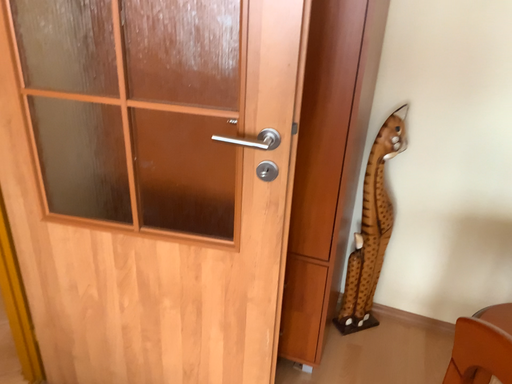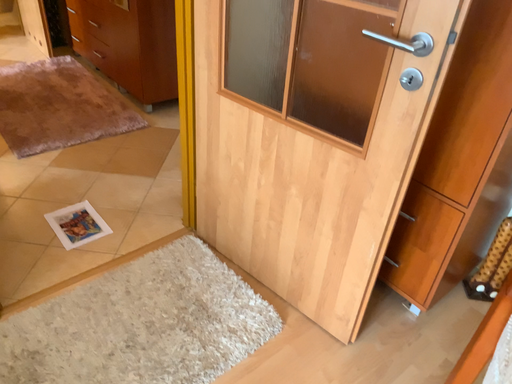
Question: How did the camera likely rotate when shooting the video?

Choices:
 (A) rotated right
 (B) rotated left

Answer: (B)